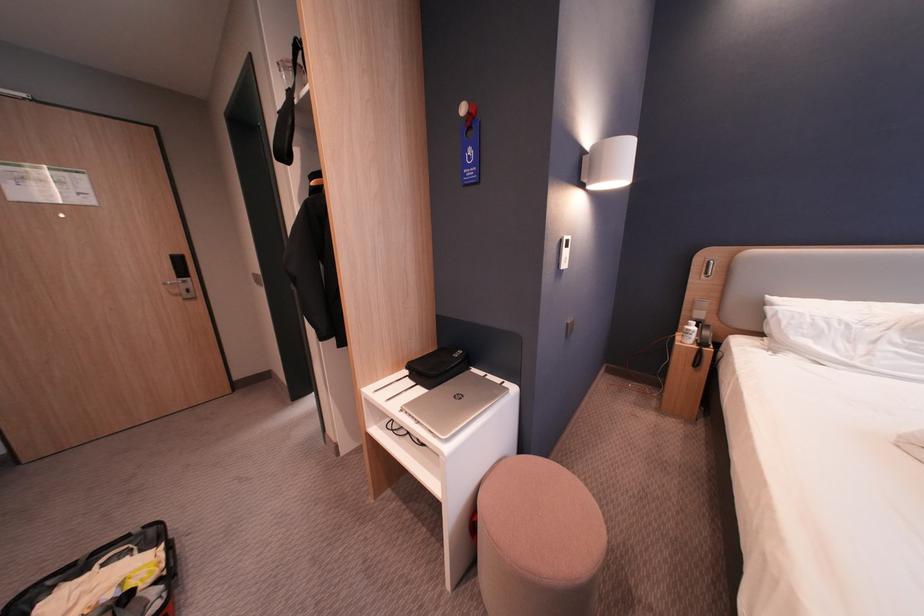
At what (x,y) coordinates should I click in order to perform the action: click on black card reader. Please return your answer as a coordinate pair (x, y). Looking at the image, I should click on (704, 334).